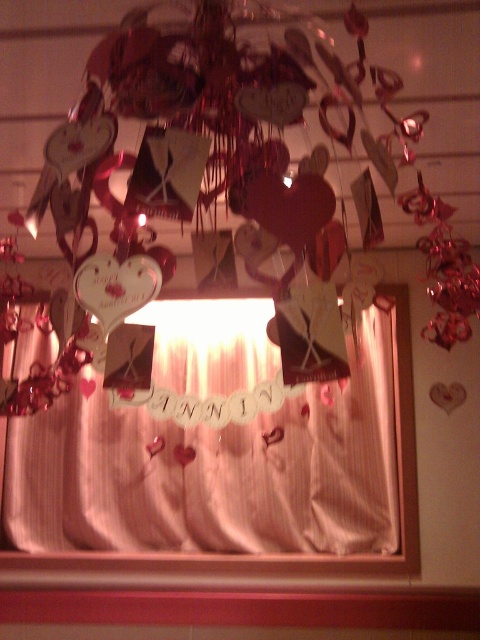
Can you confirm if matte red heart at center is smaller than silky white curtain at center?

No, matte red heart at center is not smaller than silky white curtain at center.

The height and width of the screenshot is (640, 480). What do you see at coordinates (218, 147) in the screenshot?
I see `matte red heart at center` at bounding box center [218, 147].

Find the location of a particular element. The width and height of the screenshot is (480, 640). matte red heart at center is located at coordinates (218, 147).